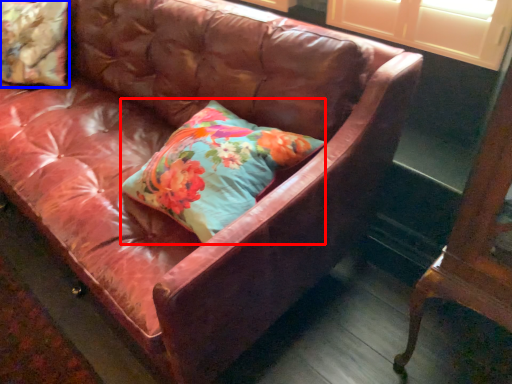
Question: Among these objects, which one is nearest to the camera, pillow (highlighted by a red box) or pillow (highlighted by a blue box)?

Choices:
 (A) pillow
 (B) pillow

Answer: (A)